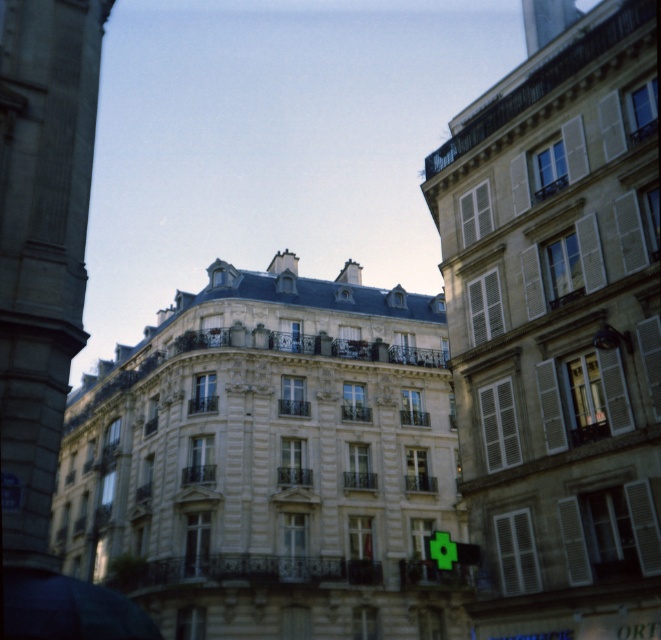
You are a city planner assessing the width of structures for a new sidewalk project. You observe the smooth beige building at center and the smooth stone tower at left in the image. Which structure has a greater width?

The smooth beige building at center has a greater width than the smooth stone tower at left, as its width surpasses the latter.

Looking at this image, you are standing on a street in front of a historic European building. You notice two points marked on the building facade. The first is at coordinates point (457, 401) and the second is at point (38, 188). Which point is closer to you as you stand facing the building?

Point (457, 401) is closer to you because it is further to the viewer than point (38, 188).

You are a tourist standing in front of the European building. You notice the smooth stone tower at left and the dark blue fabric umbrella at lower left. Which object is higher in height?

The smooth stone tower at left is taller than the dark blue fabric umbrella at lower left.